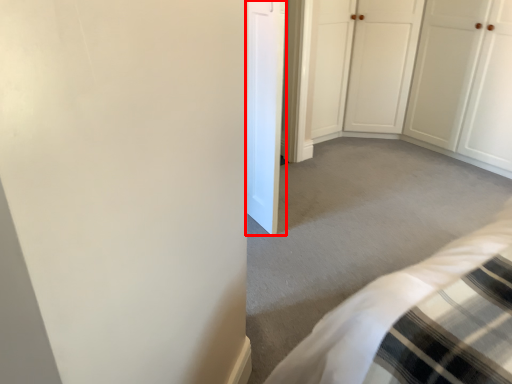
Question: From the image's perspective, considering the relative positions of door (annotated by the red box) and door in the image provided, where is door (annotated by the red box) located with respect to the staircase?

Choices:
 (A) below
 (B) above

Answer: (A)